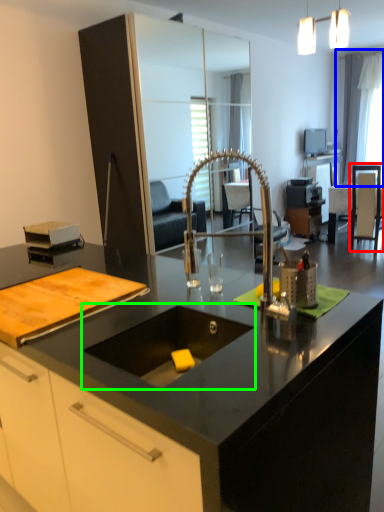
Question: Based on their relative distances, which object is nearer to armchair (highlighted by a red box)? Choose from window screen (highlighted by a blue box) and sink (highlighted by a green box).

Choices:
 (A) window screen
 (B) sink

Answer: (A)